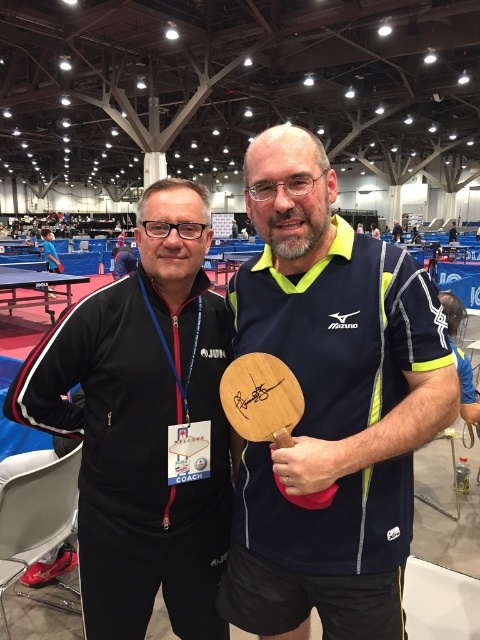
Question: From the image, what is the correct spatial relationship of wooden paddle at center in relation to black matte jacket at center?

Choices:
 (A) left
 (B) right

Answer: (B)

Question: Which object is closer to the camera taking this photo?

Choices:
 (A) black matte jacket at center
 (B) wooden paddle at center

Answer: (B)

Question: Does wooden paddle at center appear on the right side of black matte jacket at center?

Choices:
 (A) no
 (B) yes

Answer: (B)

Question: Considering the relative positions of wooden paddle at center and black matte jacket at center in the image provided, where is wooden paddle at center located with respect to black matte jacket at center?

Choices:
 (A) right
 (B) left

Answer: (A)

Question: Which of the following is the closest to the observer?

Choices:
 (A) wooden paddle at center
 (B) black matte jacket at center

Answer: (A)